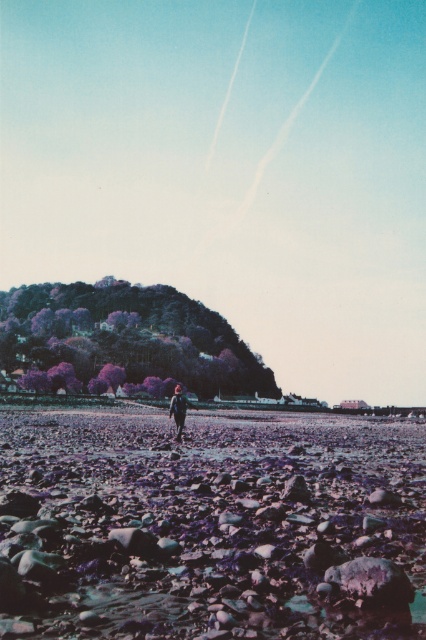
Who is more forward, (339,536) or (183,422)?

Positioned in front is point (339,536).

Measure the distance between purple gravel beach at center and camera.

6.75 meters

Which is behind, point (368, 500) or point (184, 397)?

Positioned behind is point (184, 397).

The height and width of the screenshot is (640, 426). I want to click on purple gravel beach at center, so click(206, 524).